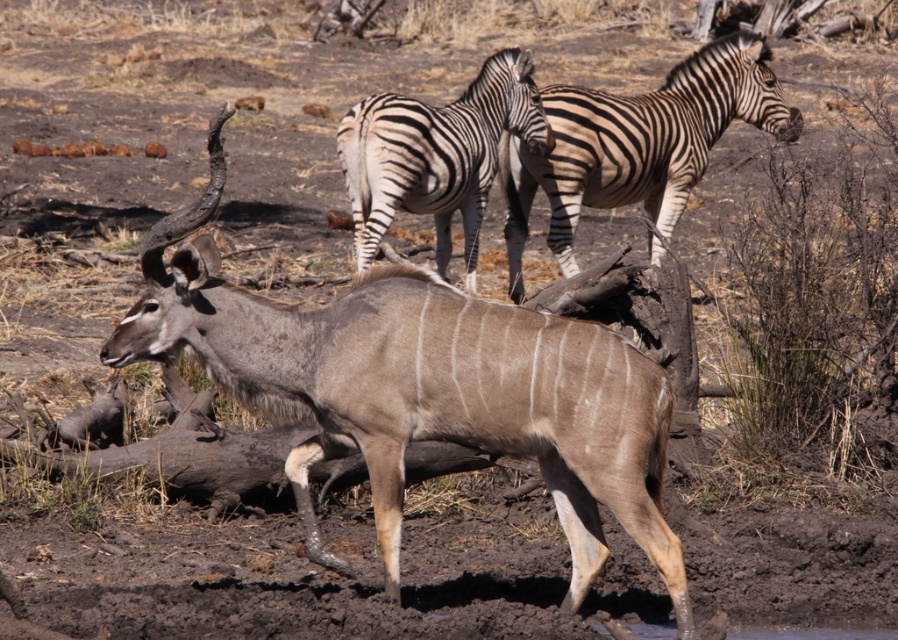
You are a wildlife photographer trying to capture a photo of both the gray textured antelope at center and the black and white striped zebra at upper center. If you want to frame both animals in the same shot without zooming, which animal should you position closer to the center of the frame to ensure both fit?

Since the gray textured antelope at center is narrower than the black and white striped zebra at upper center, you should position the gray textured antelope at center closer to the center of the frame. This allows the wider zebra to occupy more space while still keeping both within the frame without needing to zoom.

You are standing in the savanna and see two points marked in the scene. Which point, point (562,512) or point (518,280), is closer to you?

Point (562,512) is closer to the viewer than point (518,280).

In the scene shown: You are a photographer trying to capture a closeup of the zebras in the background. You have a camera with a zoom lens that can focus on objects at a specific distance. You notice two points in the scene labeled as point 1 and point 2. If point 1 is at coordinate point [650,140] and point 2 is at coordinate point [373,253], which point should you focus on to get a clearer image of the zebras?

You should focus on point 1 at coordinate point [650,140] because it is closer to the camera than point 2 at coordinate point [373,253], making it easier to capture a clear closeup of the zebras.